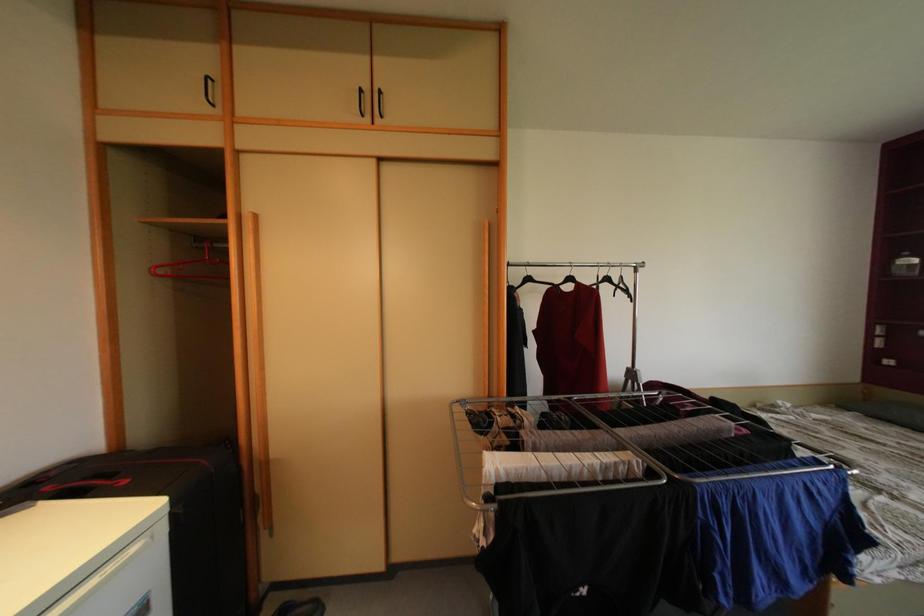
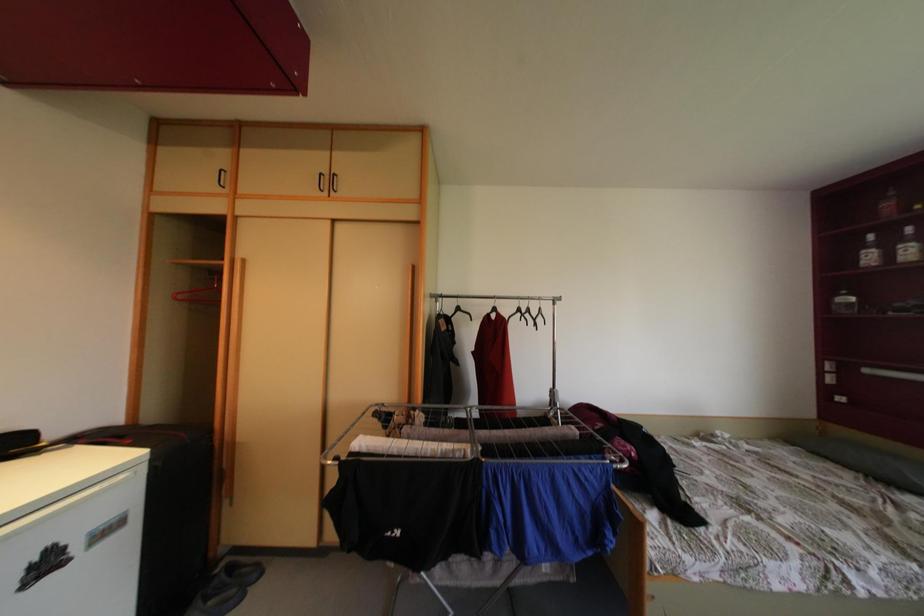
Question: Based on the continuous images, in which direction is the camera rotating? Reply with the corresponding letter.

Choices:
 (A) Left
 (B) Right
 (C) Up
 (D) Down

Answer: (C)